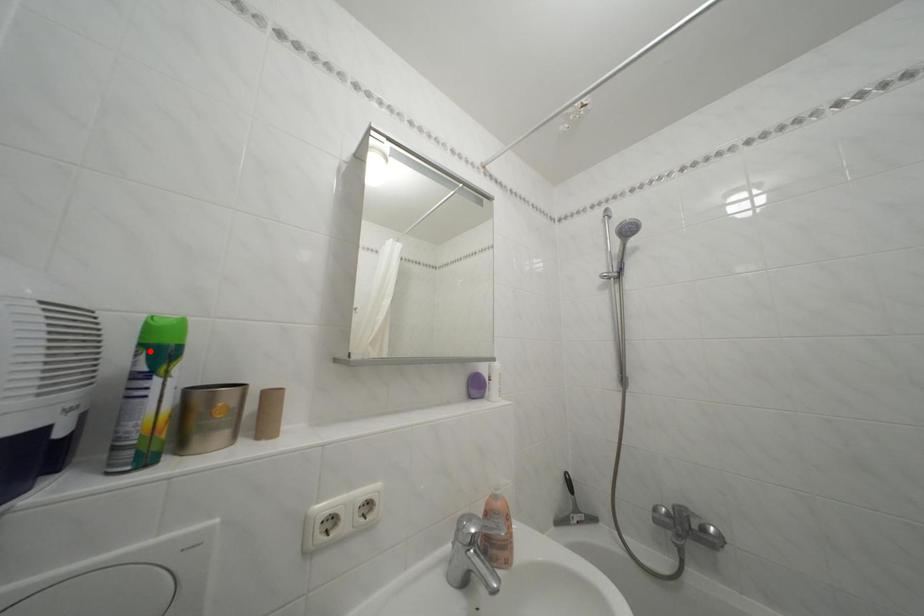
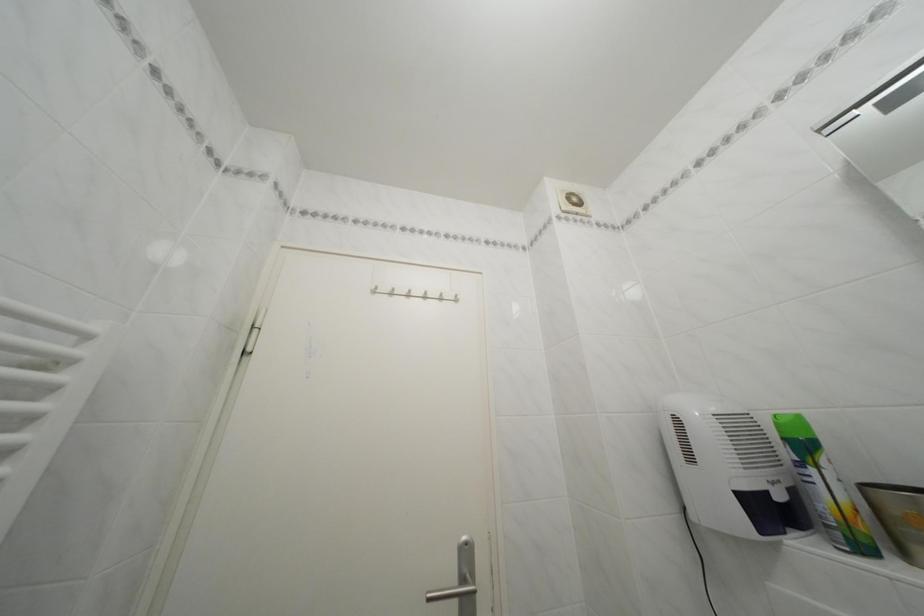
Locate, in the second image, the point that corresponds to the highlighted location in the first image.

(793, 445)